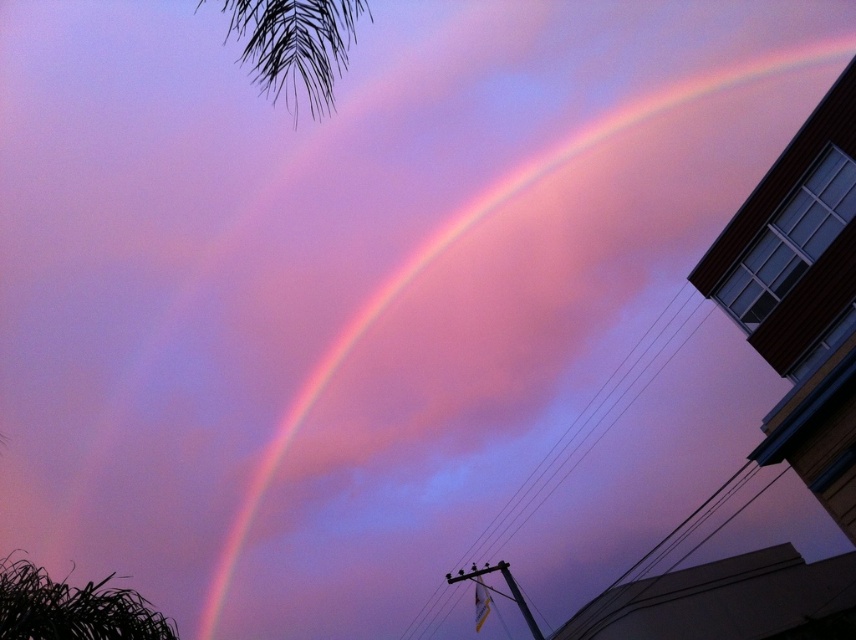
Between rainbow at upper center and black leafy palm at upper left, which one appears on the left side from the viewer's perspective?

Positioned to the left is black leafy palm at upper left.

Does rainbow at upper center appear under black leafy palm at upper left?

Yes, rainbow at upper center is below black leafy palm at upper left.

I want to click on rainbow at upper center, so click(x=456, y=243).